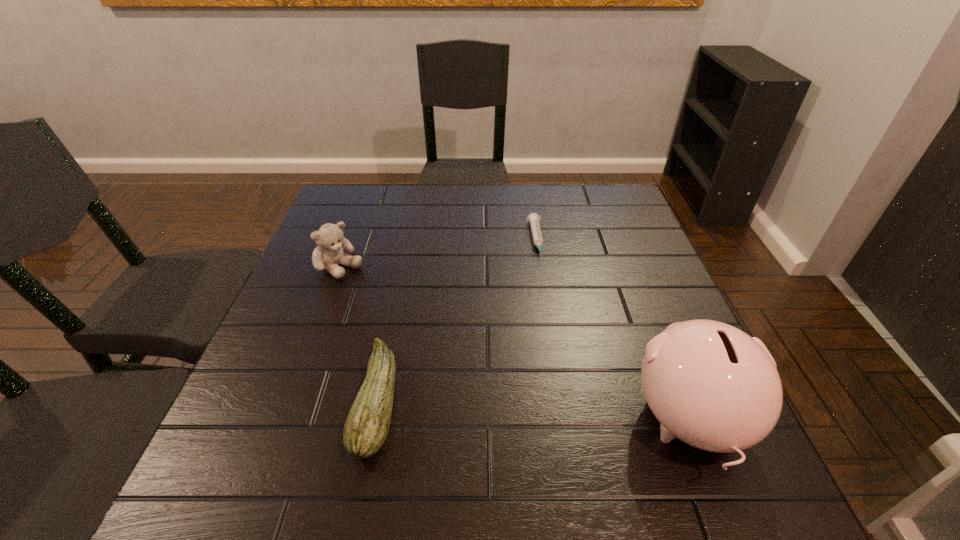
Locate an element on the screen. The image size is (960, 540). piggy bank present at the near edge is located at coordinates (709, 384).

I want to click on object present at the left edge, so click(x=330, y=239).

The image size is (960, 540). Find the location of `object at the right edge`. object at the right edge is located at coordinates (709, 384).

This screenshot has height=540, width=960. I want to click on object that is at the near right corner, so click(x=709, y=384).

Image resolution: width=960 pixels, height=540 pixels. In the image, there is a desktop. Identify the location of free region at the far edge. (564, 201).

Image resolution: width=960 pixels, height=540 pixels. In the image, there is a desktop. Find the location of `free region at the near edge`. free region at the near edge is located at coordinates (541, 421).

In the image, there is a desktop. Where is `vacant space at the left edge`? This screenshot has height=540, width=960. vacant space at the left edge is located at coordinates (319, 301).

Image resolution: width=960 pixels, height=540 pixels. Find the location of `vacant space at the right edge`. vacant space at the right edge is located at coordinates (640, 267).

Find the location of `free space at the far left corner`. free space at the far left corner is located at coordinates (351, 200).

I want to click on vacant region at the far right corner of the desktop, so click(x=586, y=201).